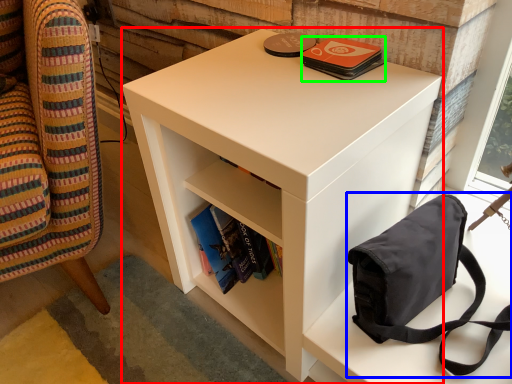
Question: Based on their relative distances, which object is farther from nightstand (highlighted by a red box)? Choose from bag (highlighted by a blue box) and paperback book (highlighted by a green box).

Choices:
 (A) bag
 (B) paperback book

Answer: (B)